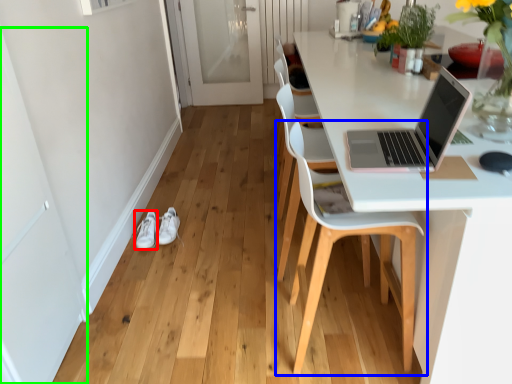
Question: Which object is the farthest from footwear (highlighted by a red box)? Choose among these: chair (highlighted by a blue box) or screen door (highlighted by a green box).

Choices:
 (A) chair
 (B) screen door

Answer: (A)